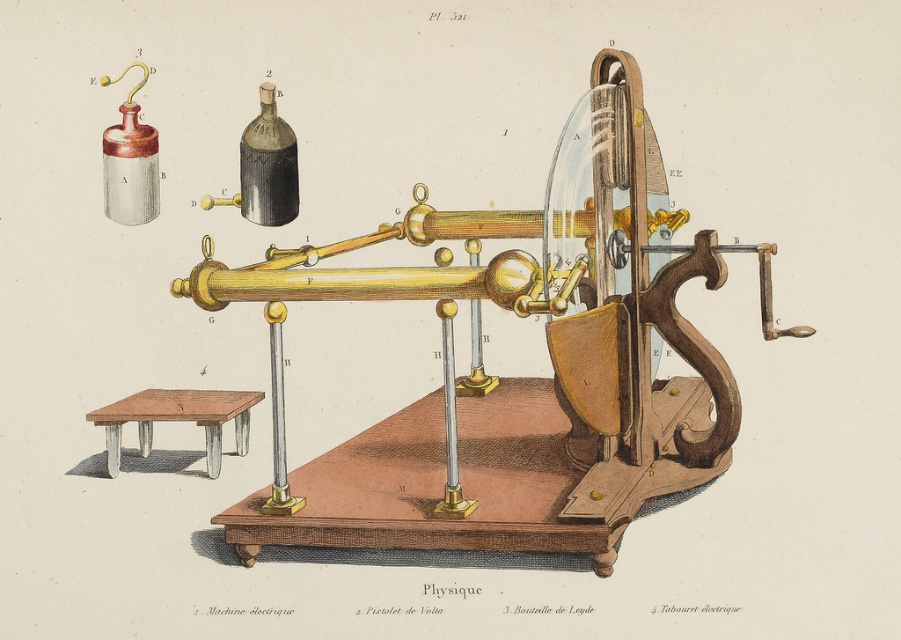
Question: Which point is farther to the camera?

Choices:
 (A) (296, 161)
 (B) (210, 445)

Answer: (A)

Question: Is polished brass telescope at center above wooden stool at lower left?

Choices:
 (A) no
 (B) yes

Answer: (B)

Question: Which point appears closest to the camera in this image?

Choices:
 (A) (463, 522)
 (B) (126, 410)
 (C) (279, 189)

Answer: (A)

Question: Is polished brass telescope at center to the left of matte black glass bottle at upper center from the viewer's perspective?

Choices:
 (A) no
 (B) yes

Answer: (A)

Question: Is polished brass telescope at center to the left of matte black glass bottle at upper center from the viewer's perspective?

Choices:
 (A) no
 (B) yes

Answer: (A)

Question: Which point is closer to the camera?

Choices:
 (A) matte black glass bottle at upper center
 (B) polished brass telescope at center

Answer: (B)